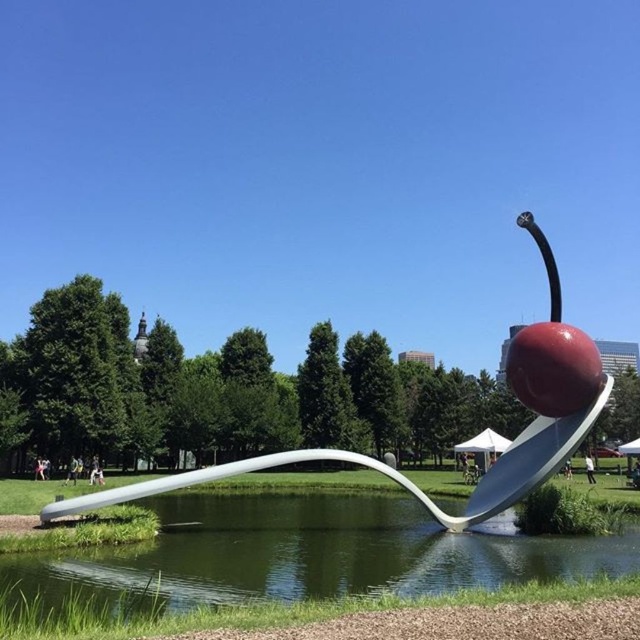
Between point (189, 552) and point (172, 477), which one is positioned behind?

The point (172, 477) is behind.

Who is positioned more to the left, clear water at spoon right or white glossy spoon at center?

white glossy spoon at center is more to the left.

The image size is (640, 640). I want to click on clear water at spoon right, so click(289, 557).